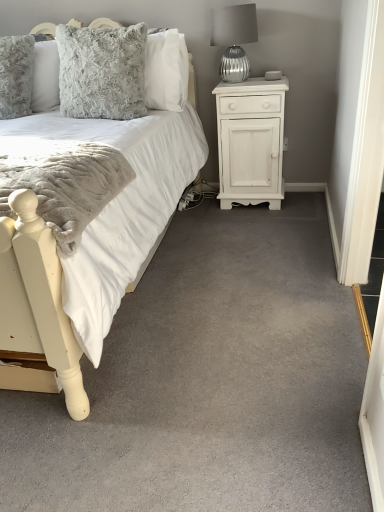
Locate an element on the screen. unoccupied area in front of white painted wood nightstand at right is located at coordinates (253, 223).